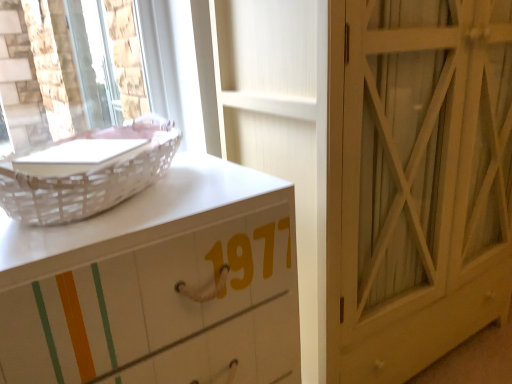
Question: Considering the positions of point (84, 329) and point (351, 349), is point (84, 329) closer or farther from the camera than point (351, 349)?

Choices:
 (A) closer
 (B) farther

Answer: (A)

Question: Is white painted wood chest of drawers at left bigger or smaller than white wood door at center-right?

Choices:
 (A) big
 (B) small

Answer: (B)

Question: Based on their relative distances, which object is farther from the white painted wood chest of drawers at left?

Choices:
 (A) white wood door at center-right
 (B) white wicker basket at upper left

Answer: (A)

Question: Which object is the closest to the white wood door at center-right?

Choices:
 (A) white painted wood chest of drawers at left
 (B) white wicker basket at upper left

Answer: (A)